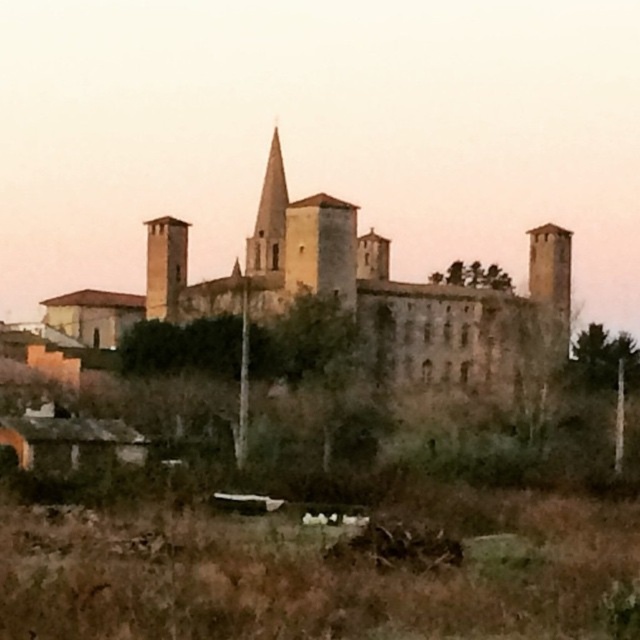
You are standing in front of the historic stone building and want to take a photo that includes both the brown stone castle at center and the smooth stone spire at center. Based on their positions, which one should be on the left side of the photo?

The smooth stone spire at center should be on the left side of the photo because the brown stone castle at center is to the right of it.